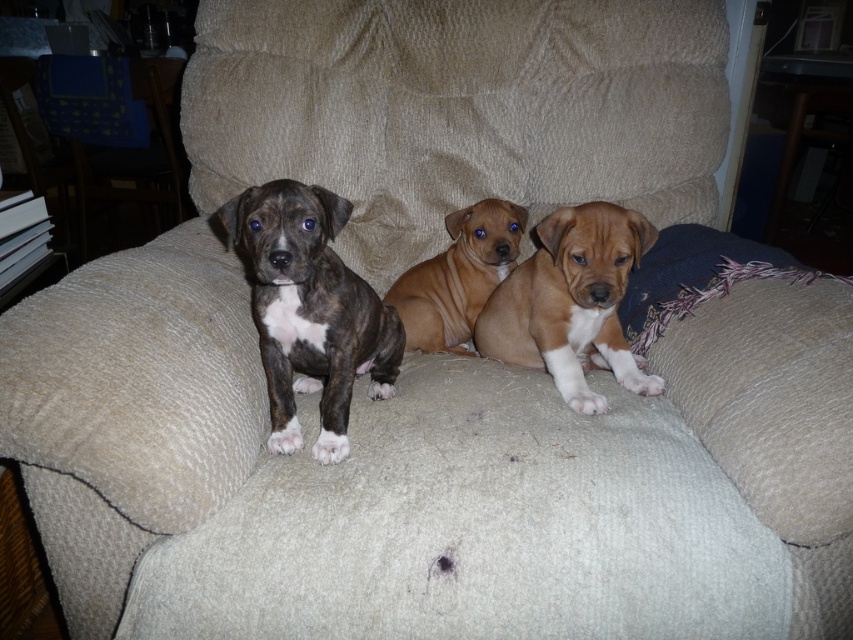
Question: Is the position of brown smooth puppy at center more distant than that of brown smooth dog at center?

Choices:
 (A) yes
 (B) no

Answer: (B)

Question: Which of the following is the farthest from the observer?

Choices:
 (A) brindle fur puppy at left
 (B) brown smooth puppy at center
 (C) brown smooth dog at center

Answer: (C)

Question: Which point appears closest to the camera in this image?

Choices:
 (A) click(x=598, y=264)
 (B) click(x=234, y=204)
 (C) click(x=468, y=304)

Answer: (B)

Question: Is brindle fur puppy at left closer to camera compared to brown smooth dog at center?

Choices:
 (A) yes
 (B) no

Answer: (A)

Question: Can you confirm if brown smooth puppy at center is positioned below brown smooth dog at center?

Choices:
 (A) yes
 (B) no

Answer: (A)

Question: Which object is positioned closest to the brown smooth dog at center?

Choices:
 (A) brindle fur puppy at left
 (B) brown smooth puppy at center

Answer: (B)